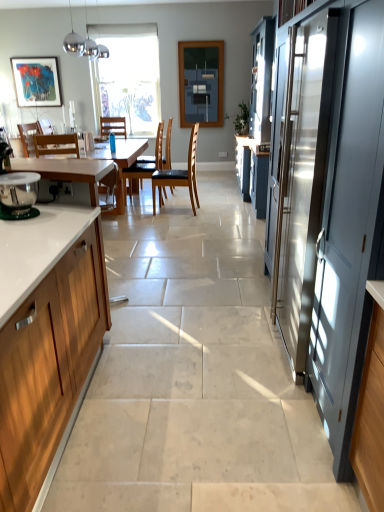
Question: From the image's perspective, is white wood cabinet at left located beneath matte gray screen door at right?

Choices:
 (A) no
 (B) yes

Answer: (B)

Question: From a real-world perspective, is white wood cabinet at left physically below matte gray screen door at right?

Choices:
 (A) no
 (B) yes

Answer: (B)

Question: Would you say matte gray screen door at right is part of white wood cabinet at left's contents?

Choices:
 (A) yes
 (B) no

Answer: (B)

Question: Is white wood cabinet at left positioned before matte gray screen door at right?

Choices:
 (A) yes
 (B) no

Answer: (A)

Question: Is white wood cabinet at left oriented towards matte gray screen door at right?

Choices:
 (A) yes
 (B) no

Answer: (B)

Question: From a real-world perspective, is matte black picture frame at upper left physically located above or below matte gray screen door at right?

Choices:
 (A) above
 (B) below

Answer: (A)

Question: Is point (39, 69) closer or farther from the camera than point (354, 195)?

Choices:
 (A) closer
 (B) farther

Answer: (B)

Question: Is matte black picture frame at upper left taller or shorter than matte gray screen door at right?

Choices:
 (A) tall
 (B) short

Answer: (B)

Question: Is matte black picture frame at upper left bigger or smaller than matte gray screen door at right?

Choices:
 (A) big
 (B) small

Answer: (B)

Question: From their relative heights in the image, would you say wooden chair at center, positioned as the 2th chair in left-to-right order, is taller or shorter than matte black picture frame at upper left?

Choices:
 (A) short
 (B) tall

Answer: (A)

Question: Considering the positions of wooden chair at center, positioned as the 2th chair in left-to-right order, and matte black picture frame at upper left in the image, is wooden chair at center, positioned as the 2th chair in left-to-right order, wider or thinner than matte black picture frame at upper left?

Choices:
 (A) thin
 (B) wide

Answer: (B)

Question: From a real-world perspective, relative to matte black picture frame at upper left, is wooden chair at center, which is counted as the third chair, starting from the right, vertically above or below?

Choices:
 (A) below
 (B) above

Answer: (A)

Question: Considering the positions of point (112, 202) and point (16, 104), is point (112, 202) closer or farther from the camera than point (16, 104)?

Choices:
 (A) closer
 (B) farther

Answer: (A)

Question: Is white wood cabinet at left inside the boundaries of matte glass window screen at center, or outside?

Choices:
 (A) outside
 (B) inside

Answer: (A)

Question: Is point (9, 330) closer or farther from the camera than point (185, 71)?

Choices:
 (A) closer
 (B) farther

Answer: (A)